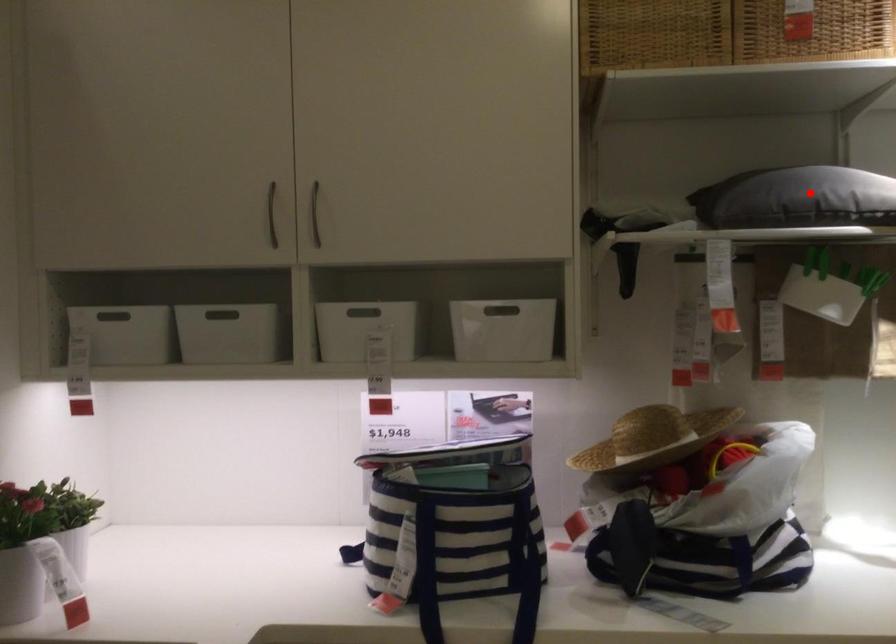
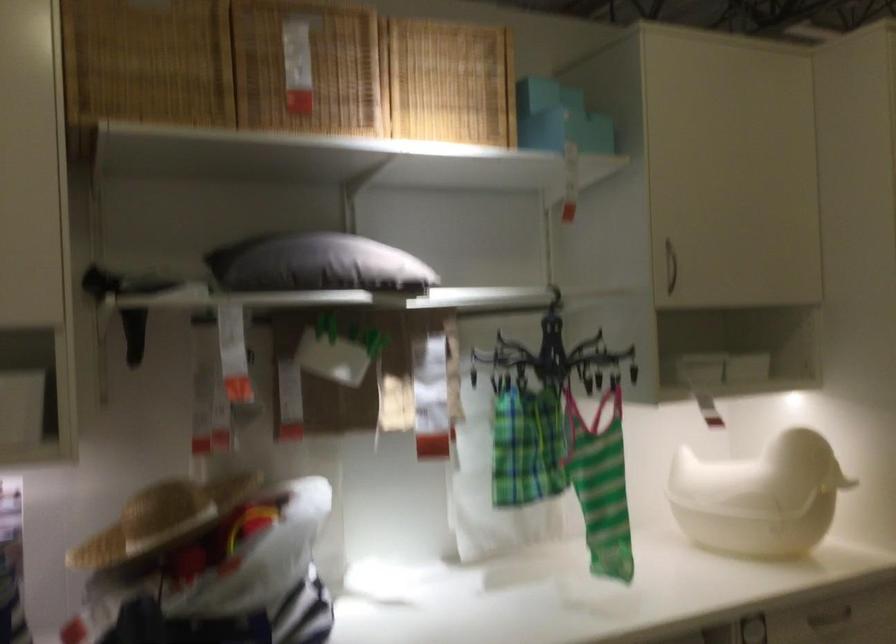
In the second image, find the point that corresponds to the highlighted location in the first image.

(316, 263)